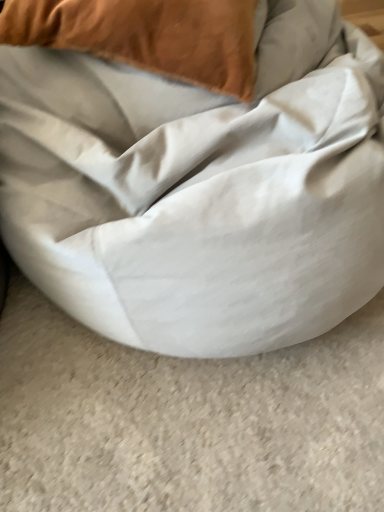
Question: Looking at their shapes, would you say velvet orange pillow at upper left is wider or thinner than white fabric bean bag at center?

Choices:
 (A) thin
 (B) wide

Answer: (A)

Question: Considering the positions of point (251, 52) and point (256, 204), is point (251, 52) closer or farther from the camera than point (256, 204)?

Choices:
 (A) farther
 (B) closer

Answer: (A)

Question: From a real-world perspective, relative to white fabric bean bag at center, is velvet orange pillow at upper left vertically above or below?

Choices:
 (A) below
 (B) above

Answer: (B)

Question: Does point (322, 321) appear closer or farther from the camera than point (21, 27)?

Choices:
 (A) closer
 (B) farther

Answer: (B)

Question: Is white fabric bean bag at center wider or thinner than velvet orange pillow at upper left?

Choices:
 (A) thin
 (B) wide

Answer: (B)

Question: Which is correct: white fabric bean bag at center is inside velvet orange pillow at upper left, or outside of it?

Choices:
 (A) outside
 (B) inside

Answer: (A)

Question: From the image's perspective, is white fabric bean bag at center located above or below velvet orange pillow at upper left?

Choices:
 (A) below
 (B) above

Answer: (A)